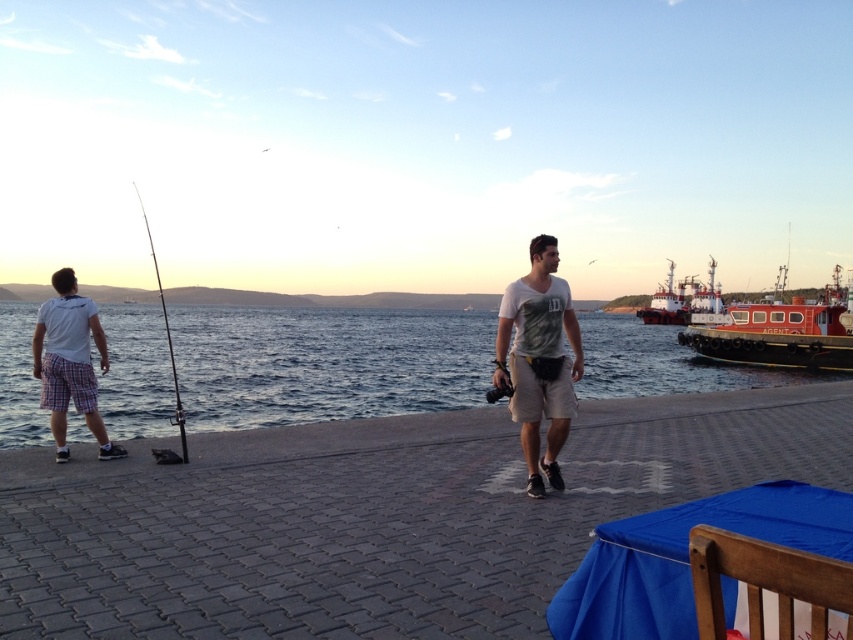
Is point (437, 378) positioned before point (718, 353)?

That is True.

Where is `blue water at center`? This screenshot has height=640, width=853. blue water at center is located at coordinates (325, 364).

In order to click on blue water at center in this screenshot , I will do `click(325, 364)`.

Looking at this image, is camouflage t-shirt at center shorter than red matte tugboat at right?

Correct, camouflage t-shirt at center is not as tall as red matte tugboat at right.

Based on the photo, between camouflage t-shirt at center and red matte tugboat at right, which one appears on the right side from the viewer's perspective?

Positioned to the right is red matte tugboat at right.

The width and height of the screenshot is (853, 640). What do you see at coordinates (538, 360) in the screenshot? I see `camouflage t-shirt at center` at bounding box center [538, 360].

Find the location of a particular element. This screenshot has width=853, height=640. camouflage t-shirt at center is located at coordinates (538, 360).

Is blue water at center positioned behind camouflage t-shirt at center?

Yes, blue water at center is further from the viewer.

Can you confirm if blue water at center is positioned above camouflage t-shirt at center?

Yes.

Who is more distant from viewer, (x=12, y=435) or (x=558, y=442)?

Positioned behind is point (x=12, y=435).

What are the coordinates of `blue water at center` in the screenshot? It's located at (325, 364).